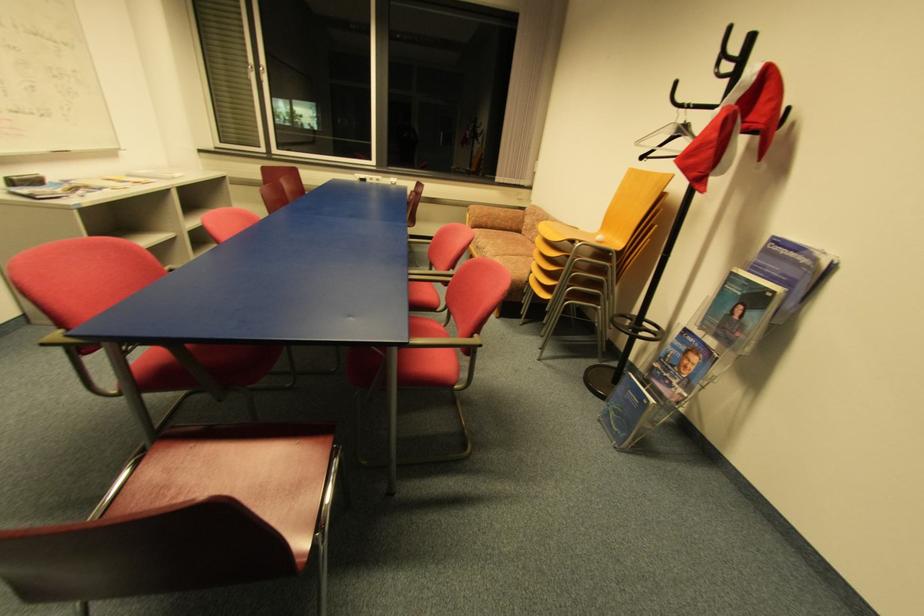
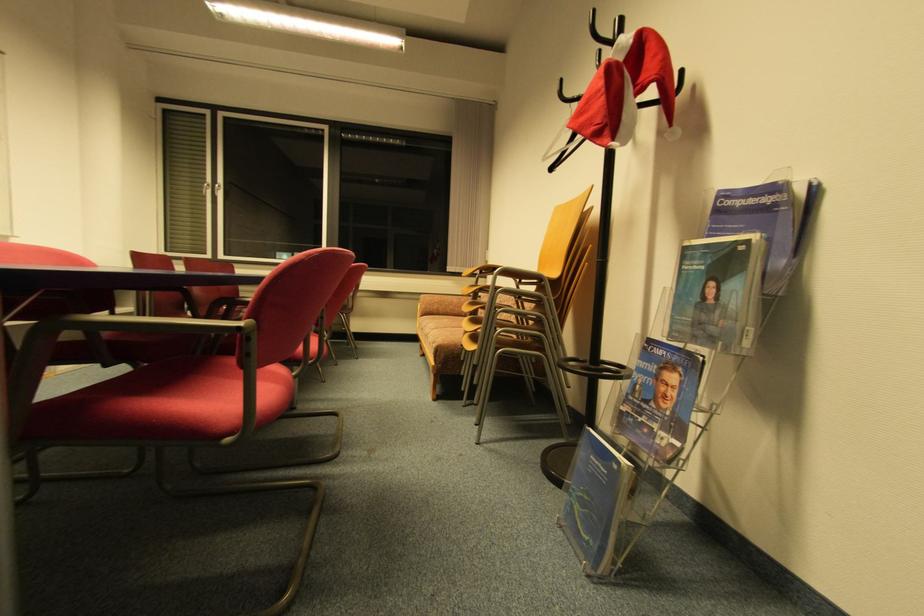
Question: The images are taken continuously from a first-person perspective. In which direction is your viewpoint rotating?

Choices:
 (A) Left
 (B) Right
 (C) Up
 (D) Down

Answer: (C)